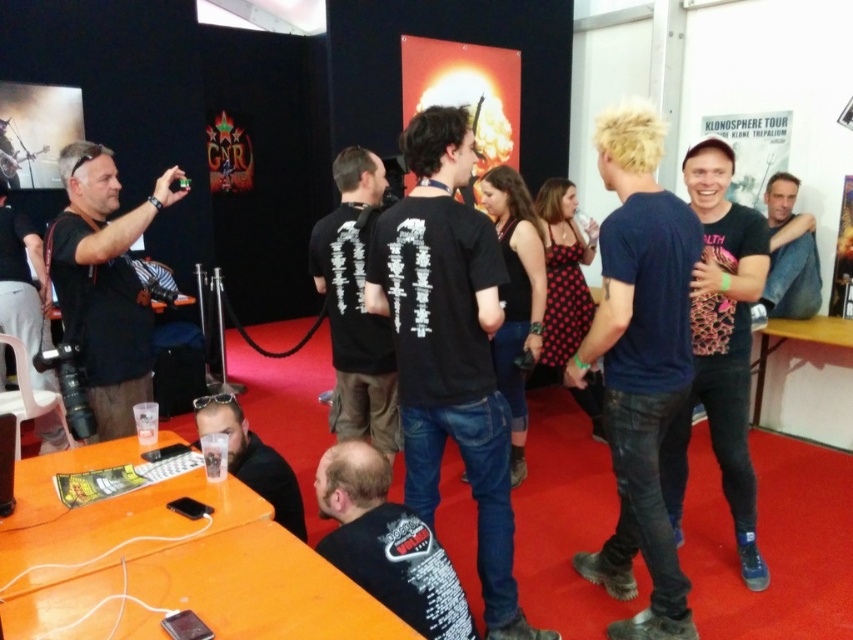
Question: Which point appears closest to the camera in this image?

Choices:
 (A) (374, 451)
 (B) (647, 376)

Answer: (A)

Question: Is black matte camera at left above matte black camera at left?

Choices:
 (A) yes
 (B) no

Answer: (B)

Question: Is blue denim jeans at right smaller than black matte camera at left?

Choices:
 (A) yes
 (B) no

Answer: (B)

Question: Is blue denim jeans at right closer to the viewer compared to black matte camera at left?

Choices:
 (A) yes
 (B) no

Answer: (A)

Question: Which point is closer to the camera?

Choices:
 (A) (631, 172)
 (B) (366, 582)
 (C) (358, 221)
 (D) (486, 556)

Answer: (B)

Question: Which object is the closest to the matte black camera at left?

Choices:
 (A) black matte shirt at center
 (B) black matte t-shirt at center

Answer: (B)